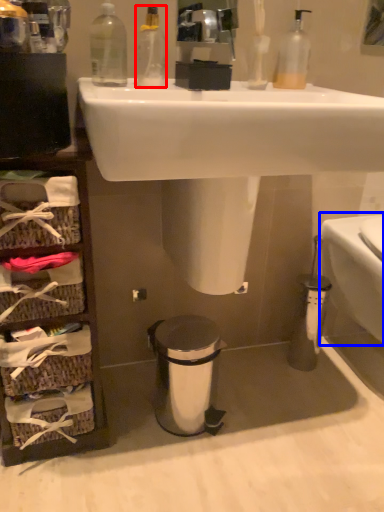
Question: Which object is closer to the camera taking this photo, cleaning product (highlighted by a red box) or toilet bowl (highlighted by a blue box)?

Choices:
 (A) cleaning product
 (B) toilet bowl

Answer: (A)